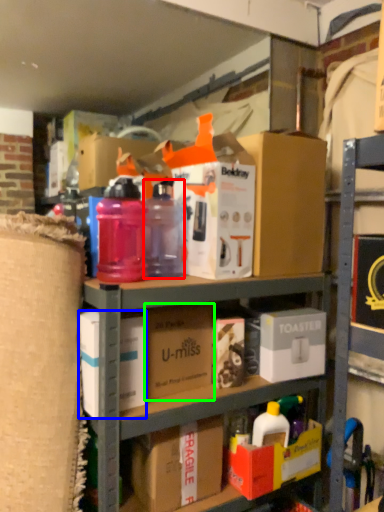
Question: Based on their relative distances, which object is farther from bottle (highlighted by a red box)? Choose from box (highlighted by a blue box) and cardboard box (highlighted by a green box).

Choices:
 (A) box
 (B) cardboard box

Answer: (A)